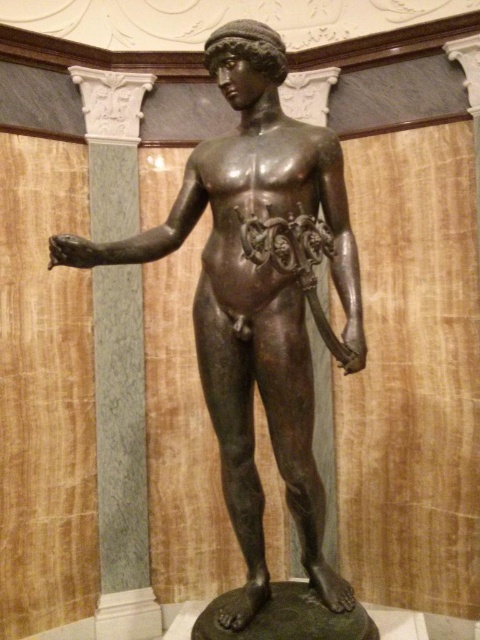
Question: Does bronze statue at center come in front of white marble column at left?

Choices:
 (A) yes
 (B) no

Answer: (A)

Question: Which point is closer to the camera?

Choices:
 (A) (110, 577)
 (B) (79, 257)

Answer: (B)

Question: Observing the image, what is the correct spatial positioning of bronze statue at center in reference to white marble column at left?

Choices:
 (A) above
 (B) below

Answer: (A)

Question: Does bronze statue at center appear under white marble column at left?

Choices:
 (A) no
 (B) yes

Answer: (A)